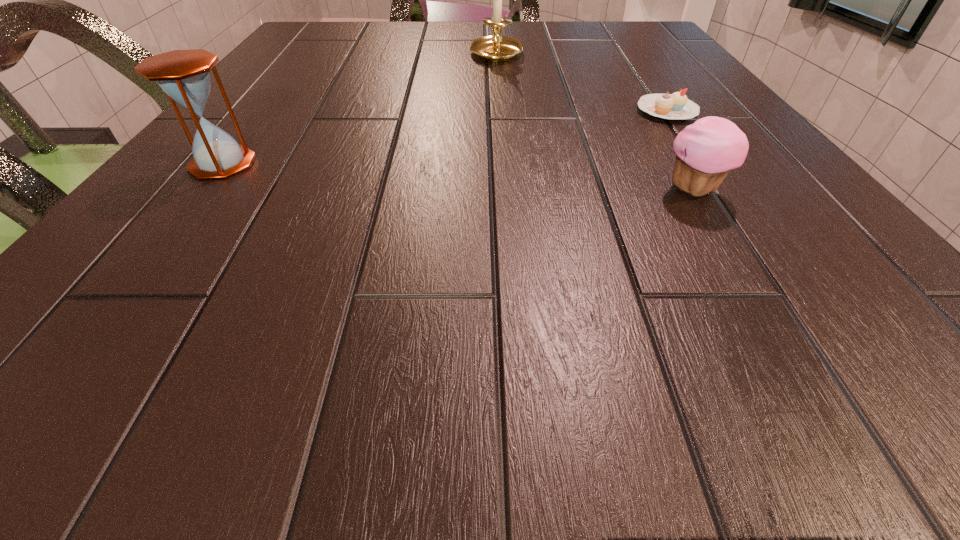
Identify the location of free space that is in between the farther cupcake and the third object from right to left. Image resolution: width=960 pixels, height=540 pixels. click(x=582, y=83).

Locate an element on the screen. The image size is (960, 540). unoccupied position between the hourglass and the third nearest object is located at coordinates (444, 137).

This screenshot has width=960, height=540. What are the coordinates of `unoccupied area between the farthest object and the nearer cupcake` in the screenshot? It's located at (595, 122).

This screenshot has height=540, width=960. I want to click on unoccupied area between the shorter cupcake and the leftmost object, so click(x=444, y=137).

You are a GUI agent. You are given a task and a screenshot of the screen. Output one action in this format:
    pyautogui.click(x=<x>, y=<y>)
    Task: Click on the free point between the taller cupcake and the leftmost object
    The width and height of the screenshot is (960, 540).
    Given the screenshot: What is the action you would take?
    pyautogui.click(x=458, y=177)

The width and height of the screenshot is (960, 540). Find the location of `free point between the hourglass and the second object from left to right`. free point between the hourglass and the second object from left to right is located at coordinates (360, 110).

Image resolution: width=960 pixels, height=540 pixels. What are the coordinates of `vacant space that's between the nearer cupcake and the farthest object` in the screenshot? It's located at (595, 122).

The height and width of the screenshot is (540, 960). I want to click on free spot between the second object from left to right and the hourglass, so click(360, 110).

Choose which object is the second nearest neighbor to the candle holder. Please provide its 2D coordinates. Your answer should be formatted as a tuple, i.e. [(x, y)], where the tuple contains the x and y coordinates of a point satisfying the conditions above.

[(706, 151)]

Locate an element on the screen. object that is the second nearest to the leftmost object is located at coordinates (706, 151).